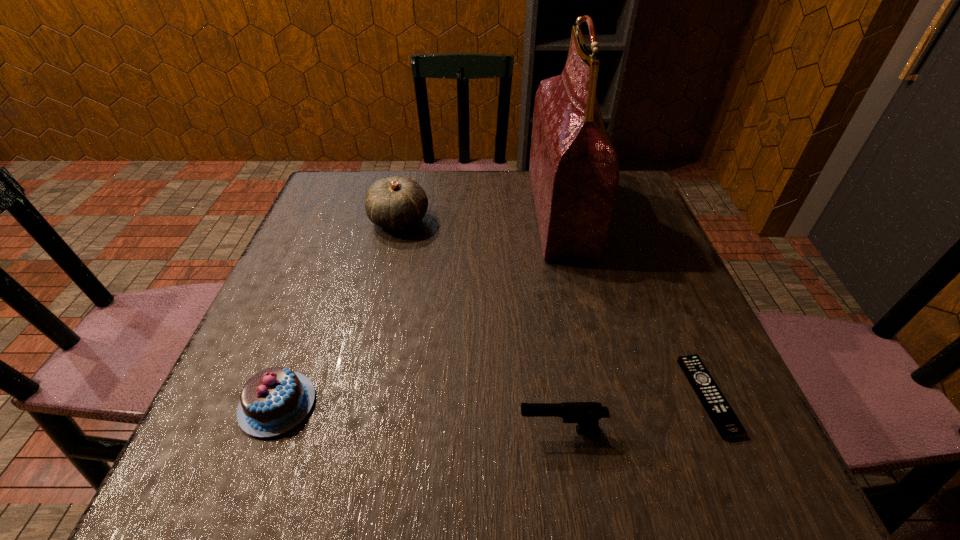
You are a GUI agent. You are given a task and a screenshot of the screen. Output one action in this format:
    pyautogui.click(x=<x>, y=<y>)
    Task: Click on the gourd that is at the left edge
    The width and height of the screenshot is (960, 540).
    Given the screenshot: What is the action you would take?
    pyautogui.click(x=396, y=203)

Locate an element on the screen. The width and height of the screenshot is (960, 540). chocolate cake situated at the left edge is located at coordinates (275, 400).

The height and width of the screenshot is (540, 960). Find the location of `object positioned at the right edge`. object positioned at the right edge is located at coordinates (728, 425).

Identify the location of object that is at the far left corner. (396, 203).

In order to click on object positioned at the near left corner in this screenshot , I will do `click(275, 400)`.

I want to click on object situated at the near right corner, so click(x=728, y=425).

I want to click on free space at the far edge, so click(526, 201).

At what (x,y) coordinates should I click in order to perform the action: click on free space at the near edge. Please return your answer as a coordinate pair (x, y). This screenshot has height=540, width=960. Looking at the image, I should click on (336, 476).

Where is `vacant space at the left edge`? The width and height of the screenshot is (960, 540). vacant space at the left edge is located at coordinates (324, 296).

In the image, there is a desktop. Where is `vacant space at the right edge`? This screenshot has width=960, height=540. vacant space at the right edge is located at coordinates (662, 240).